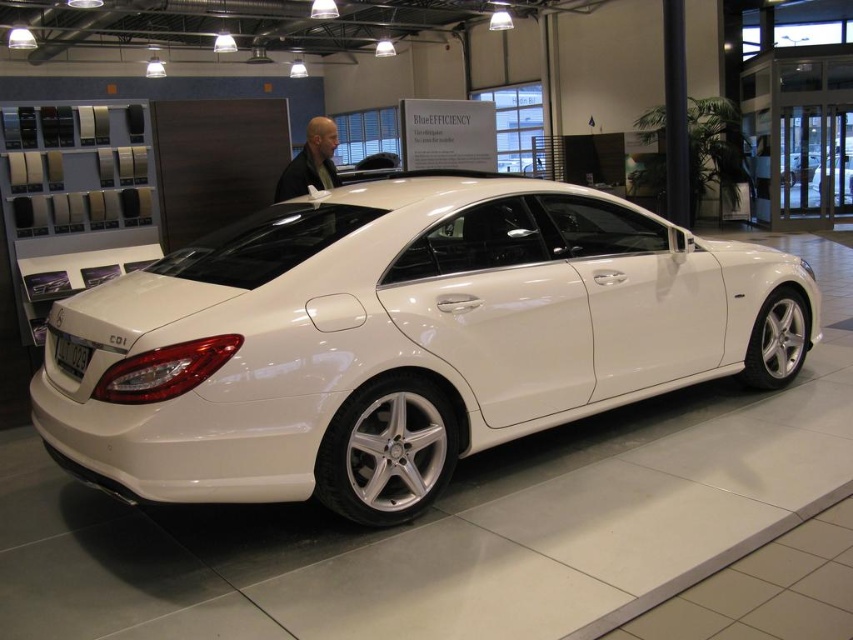
Question: Which of the following is the closest to the observer?

Choices:
 (A) light brown hair at center
 (B) white metallic car at center

Answer: (B)

Question: Does white metallic car at center have a greater width compared to light brown hair at center?

Choices:
 (A) no
 (B) yes

Answer: (B)

Question: Can you confirm if white metallic car at center is wider than light brown hair at center?

Choices:
 (A) no
 (B) yes

Answer: (B)

Question: Which point is closer to the camera?

Choices:
 (A) white metallic car at center
 (B) light brown hair at center

Answer: (A)

Question: Which of the following is the farthest from the observer?

Choices:
 (A) (132, 410)
 (B) (318, 134)

Answer: (B)

Question: Is white metallic car at center to the right of light brown hair at center from the viewer's perspective?

Choices:
 (A) no
 (B) yes

Answer: (B)